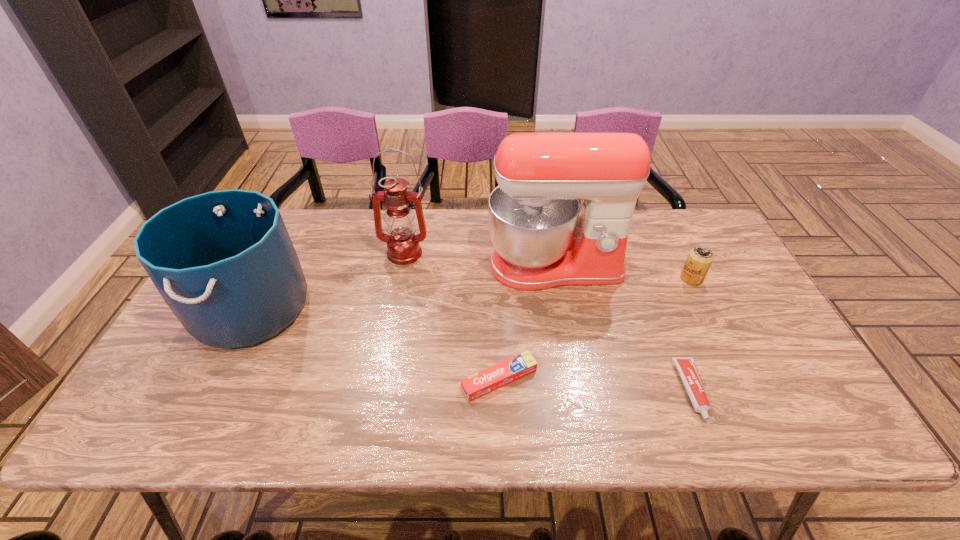
Identify the location of free space located on the back of the third tallest object. (300, 211).

At what (x,y) coordinates should I click in order to perform the action: click on free space located 0.120m on the left of the rightmost object. Please return your answer as a coordinate pair (x, y). This screenshot has width=960, height=540. Looking at the image, I should click on (639, 279).

Find the location of a particular element. vacant region located 0.340m on the back of the left toothpaste is located at coordinates (495, 266).

I want to click on mixer positioned at the far edge, so click(x=543, y=237).

Find the location of `oil lamp present at the far edge`. oil lamp present at the far edge is located at coordinates (403, 246).

Where is `object at the left edge`? This screenshot has height=540, width=960. object at the left edge is located at coordinates (223, 261).

At what (x,y) coordinates should I click in order to perform the action: click on object present at the right edge. Please return your answer as a coordinate pair (x, y). Looking at the image, I should click on (699, 260).

The image size is (960, 540). In order to click on free space at the near edge of the desktop in this screenshot , I will do `click(723, 429)`.

The width and height of the screenshot is (960, 540). I want to click on vacant space at the left edge of the desktop, so click(x=150, y=402).

In the image, there is a desktop. Identify the location of vacant space at the right edge. (768, 379).